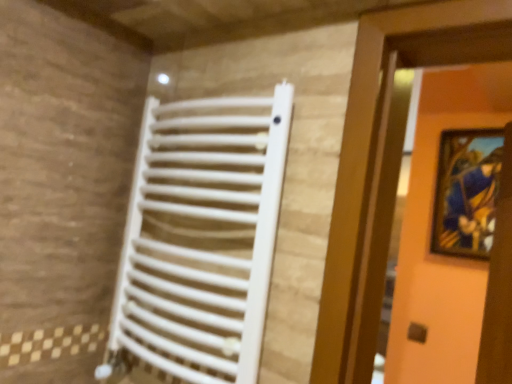
What do you see at coordinates (201, 238) in the screenshot? This screenshot has height=384, width=512. I see `white matte radiator at center` at bounding box center [201, 238].

At what (x,y) coordinates should I click in order to perform the action: click on white matte radiator at center. Please return your answer as a coordinate pair (x, y). This screenshot has width=512, height=384. Looking at the image, I should click on (201, 238).

What do you see at coordinates (467, 192) in the screenshot? The width and height of the screenshot is (512, 384). I see `matte wooden picture frame at upper right` at bounding box center [467, 192].

I want to click on matte wooden picture frame at upper right, so click(467, 192).

In order to face matte wooden picture frame at upper right, should I rotate leftwards or rightwards?

Turn right approximately 26.780 degrees to face it.

You are a GUI agent. You are given a task and a screenshot of the screen. Output one action in this format:
    pyautogui.click(x=<x>, y=<y>)
    Task: Click on the white matte radiator at center
    
    Given the screenshot: What is the action you would take?
    pyautogui.click(x=201, y=238)

Is white matte radiator at center at the left side of matte wooden picture frame at upper right?

Yes, white matte radiator at center is to the left of matte wooden picture frame at upper right.

Which is in front, white matte radiator at center or matte wooden picture frame at upper right?

white matte radiator at center is closer to the camera.

Considering the points (260, 241) and (433, 246), which point is in front, point (260, 241) or point (433, 246)?

The point (260, 241) is more forward.

From the image's perspective, would you say white matte radiator at center is shown under matte wooden picture frame at upper right?

Correct, white matte radiator at center appears lower than matte wooden picture frame at upper right in the image.

In the scene shown: From a real-world perspective, is white matte radiator at center located higher than matte wooden picture frame at upper right?

No, from a real-world perspective, white matte radiator at center is not above matte wooden picture frame at upper right.

Considering the relative sizes of white matte radiator at center and matte wooden picture frame at upper right in the image provided, is white matte radiator at center wider than matte wooden picture frame at upper right?

Yes.

Based on the photo, in terms of height, does white matte radiator at center look taller or shorter compared to matte wooden picture frame at upper right?

white matte radiator at center is taller than matte wooden picture frame at upper right.

Considering the relative sizes of white matte radiator at center and matte wooden picture frame at upper right in the image provided, is white matte radiator at center smaller than matte wooden picture frame at upper right?

No.

Would you say white matte radiator at center is outside matte wooden picture frame at upper right?

white matte radiator at center is positioned outside matte wooden picture frame at upper right.

Is the surface of white matte radiator at center in direct contact with matte wooden picture frame at upper right?

No, white matte radiator at center is not next to matte wooden picture frame at upper right.

From the picture: Could you tell me if white matte radiator at center is facing matte wooden picture frame at upper right?

No, white matte radiator at center is not aimed at matte wooden picture frame at upper right.

Consider the image. What's the angular difference between white matte radiator at center and matte wooden picture frame at upper right's facing directions?

There is a 0.532-degree angle between the facing directions of white matte radiator at center and matte wooden picture frame at upper right.

Where is `picture frame behind the white matte radiator at center`? This screenshot has height=384, width=512. picture frame behind the white matte radiator at center is located at coordinates (467, 192).

Considering the positions of objects matte wooden picture frame at upper right and white matte radiator at center in the image provided, who is more to the right, matte wooden picture frame at upper right or white matte radiator at center?

matte wooden picture frame at upper right is more to the right.

Which object is closer to the camera, matte wooden picture frame at upper right or white matte radiator at center?

white matte radiator at center.

Which is behind, point (452, 134) or point (146, 155)?

Point (452, 134)

Consider the image. From the image's perspective, between matte wooden picture frame at upper right and white matte radiator at center, which one is located above?

From the image's view, matte wooden picture frame at upper right is above.

From a real-world perspective, relative to white matte radiator at center, is matte wooden picture frame at upper right vertically above or below?

In terms of real-world spatial position, matte wooden picture frame at upper right is above white matte radiator at center.

Considering the sizes of objects matte wooden picture frame at upper right and white matte radiator at center in the image provided, who is wider, matte wooden picture frame at upper right or white matte radiator at center?

white matte radiator at center.

Considering the sizes of matte wooden picture frame at upper right and white matte radiator at center in the image, is matte wooden picture frame at upper right taller or shorter than white matte radiator at center?

In the image, matte wooden picture frame at upper right appears to be shorter than white matte radiator at center.

Is matte wooden picture frame at upper right smaller than white matte radiator at center?

Yes, matte wooden picture frame at upper right is smaller than white matte radiator at center.

Which is correct: matte wooden picture frame at upper right is inside white matte radiator at center, or outside of it?

matte wooden picture frame at upper right cannot be found inside white matte radiator at center.

Are matte wooden picture frame at upper right and white matte radiator at center far apart?

matte wooden picture frame at upper right is far away from white matte radiator at center.

Is matte wooden picture frame at upper right facing away from white matte radiator at center?

matte wooden picture frame at upper right does not have its back to white matte radiator at center.

How many degrees apart are the facing directions of matte wooden picture frame at upper right and white matte radiator at center?

The facing directions of matte wooden picture frame at upper right and white matte radiator at center are 0.532 degrees apart.

What are the coordinates of `radiator below the matte wooden picture frame at upper right (from the image's perspective)` in the screenshot? It's located at (201, 238).

Where is `picture frame on the right of the white matte radiator at center`? The height and width of the screenshot is (384, 512). picture frame on the right of the white matte radiator at center is located at coordinates (467, 192).

Locate an element on the screen. This screenshot has height=384, width=512. picture frame positioned vertically above the white matte radiator at center (from a real-world perspective) is located at coordinates click(467, 192).